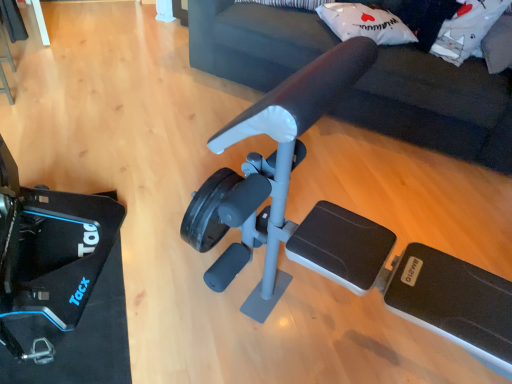
Question: From a real-world perspective, is white soft pillow at upper right, which is the second pillow from left to right, positioned under matte black exercise machine at center based on gravity?

Choices:
 (A) no
 (B) yes

Answer: (A)

Question: Is white soft pillow at upper right, which is the first pillow in right-to-left order, closer to the viewer compared to matte black exercise machine at center?

Choices:
 (A) yes
 (B) no

Answer: (B)

Question: Is white soft pillow at upper right, which is the second pillow from left to right, outside matte black exercise machine at center?

Choices:
 (A) no
 (B) yes

Answer: (A)

Question: Considering the relative sizes of white soft pillow at upper right, which is the second pillow from left to right, and matte black exercise machine at center in the image provided, is white soft pillow at upper right, which is the second pillow from left to right, thinner than matte black exercise machine at center?

Choices:
 (A) yes
 (B) no

Answer: (A)

Question: Does white soft pillow at upper right, which is the first pillow in right-to-left order, have a greater height compared to matte black exercise machine at center?

Choices:
 (A) yes
 (B) no

Answer: (B)

Question: From the image's perspective, is white soft pillow at upper right, which is the first pillow in right-to-left order, located above matte black exercise machine at center?

Choices:
 (A) no
 (B) yes

Answer: (A)

Question: Considering the relative sizes of white matte pillow at upper center, the 2th pillow in the right-to-left sequence, and white soft pillow at upper right, which is the second pillow from left to right, in the image provided, is white matte pillow at upper center, the 2th pillow in the right-to-left sequence, shorter than white soft pillow at upper right, which is the second pillow from left to right,?

Choices:
 (A) no
 (B) yes

Answer: (B)

Question: Is white matte pillow at upper center, the 2th pillow in the right-to-left sequence, oriented away from white soft pillow at upper right, which is the second pillow from left to right?

Choices:
 (A) yes
 (B) no

Answer: (B)

Question: Is white matte pillow at upper center, the 2th pillow in the right-to-left sequence, smaller than white soft pillow at upper right, which is the second pillow from left to right?

Choices:
 (A) no
 (B) yes

Answer: (B)

Question: Is white matte pillow at upper center, positioned as the first pillow in left-to-right order, not inside white soft pillow at upper right, which is the second pillow from left to right?

Choices:
 (A) yes
 (B) no

Answer: (A)

Question: Is white matte pillow at upper center, positioned as the first pillow in left-to-right order, thinner than white soft pillow at upper right, which is the first pillow in right-to-left order?

Choices:
 (A) no
 (B) yes

Answer: (B)

Question: Considering the relative sizes of white matte pillow at upper center, positioned as the first pillow in left-to-right order, and white soft pillow at upper right, which is the second pillow from left to right, in the image provided, is white matte pillow at upper center, positioned as the first pillow in left-to-right order, wider than white soft pillow at upper right, which is the second pillow from left to right,?

Choices:
 (A) no
 (B) yes

Answer: (A)

Question: Is matte black exercise machine at center outside of white soft pillow at upper right, which is the first pillow in right-to-left order?

Choices:
 (A) yes
 (B) no

Answer: (A)